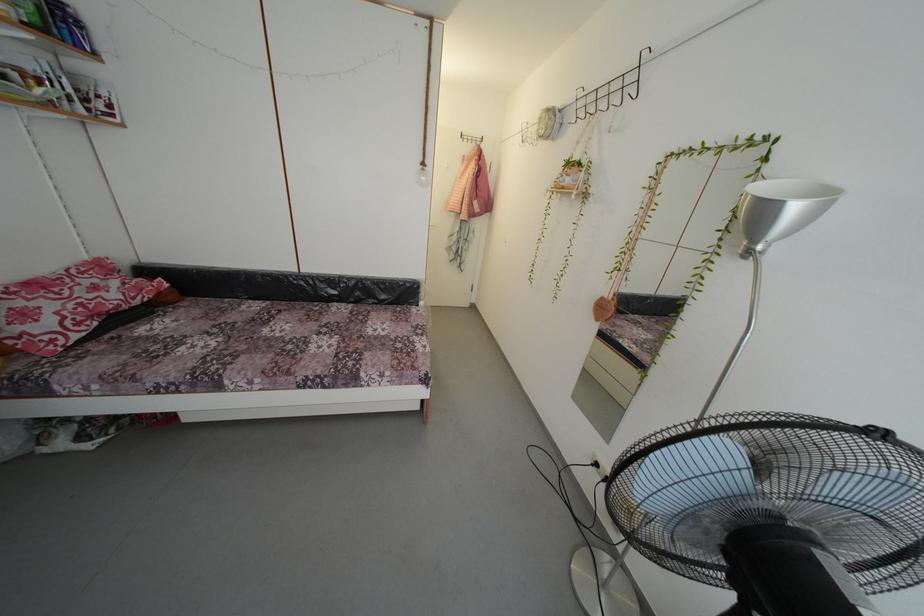
What do you see at coordinates (273, 325) in the screenshot? Image resolution: width=924 pixels, height=616 pixels. I see `the sofa sitting surface` at bounding box center [273, 325].